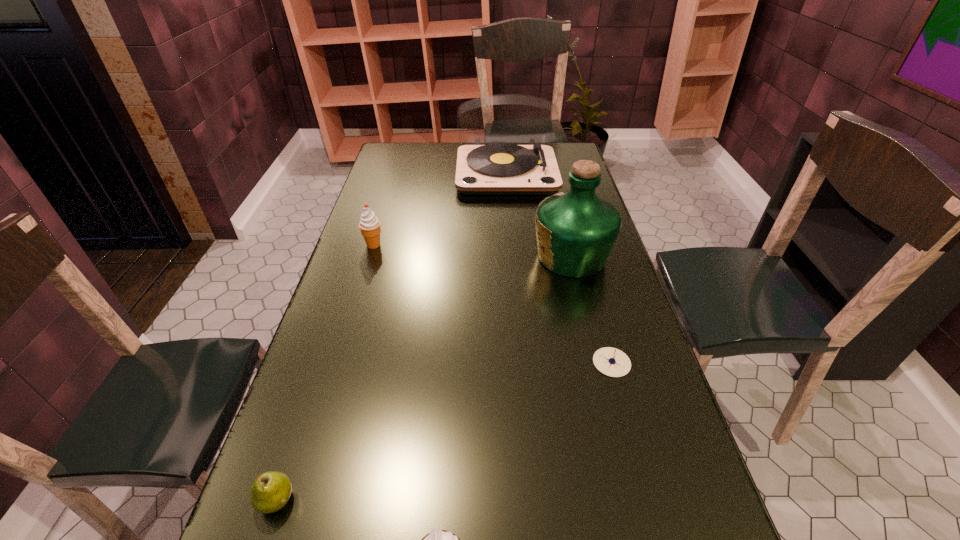
Identify the location of object at the far right corner. (494, 169).

In the image, there is a desktop. Identify the location of blank space at the left edge. (356, 250).

Identify the location of free space at the right edge of the desktop. Image resolution: width=960 pixels, height=540 pixels. (652, 496).

I want to click on free space at the far left corner of the desktop, so click(406, 146).

Where is `free space between the fourth farthest object and the liquor`? This screenshot has width=960, height=540. free space between the fourth farthest object and the liquor is located at coordinates (591, 309).

The image size is (960, 540). Find the location of `vacant area that lies between the fifth tallest object and the farthest object`. vacant area that lies between the fifth tallest object and the farthest object is located at coordinates (391, 336).

You are a GUI agent. You are given a task and a screenshot of the screen. Output one action in this format:
    pyautogui.click(x=<x>, y=<y>)
    Task: Click on the unoccupied position between the liquor and the pear
    This screenshot has height=540, width=960.
    Given the screenshot: What is the action you would take?
    pyautogui.click(x=423, y=378)

Image resolution: width=960 pixels, height=540 pixels. What are the coordinates of `vacant area that lies between the record player and the farther icecream` in the screenshot? It's located at (440, 208).

This screenshot has height=540, width=960. In order to click on free area in between the left icecream and the liquor in this screenshot , I will do `click(472, 251)`.

You are a GUI agent. You are given a task and a screenshot of the screen. Output one action in this format:
    pyautogui.click(x=<x>, y=<y>)
    Task: Click on the vacant space in between the second nearest object and the compass
    
    Given the screenshot: What is the action you would take?
    click(444, 431)